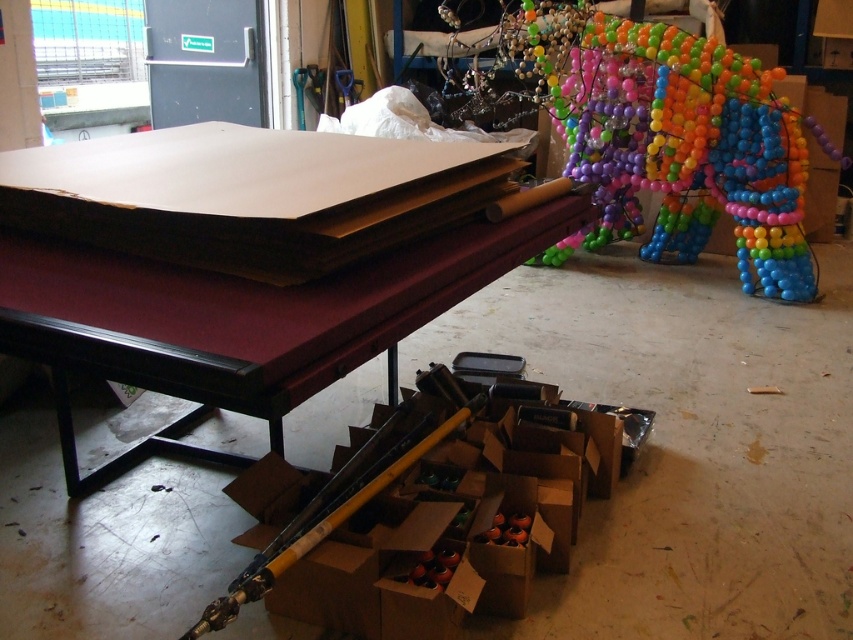
You are standing in the workshop and want to place a new decorative item on the closest object. Which object should you choose between the maroon felt pool table at center and the multicolored plastic balloon at upper right?

The maroon felt pool table at center is closer to the viewer than the multicolored plastic balloon at upper right, so you should place the decorative item on the maroon felt pool table at center.

You are an artist planning to place a large sculpture in your workspace. You have the maroon felt pool table at center and the multicolored plastic balloon at upper right. Which object takes up more space in the workspace?

The multicolored plastic balloon at upper right takes up more space in the workspace because it is larger than the maroon felt pool table at center according to the description.

You are setting up a birthday party and need to place a decorative balloon. Based on the scene, where should you place the multicolored plastic balloon at upper right relative to the maroon felt pool table at center to match the image?

The multicolored plastic balloon at upper right should be placed above the maroon felt pool table at center as it is positioned above in the image.